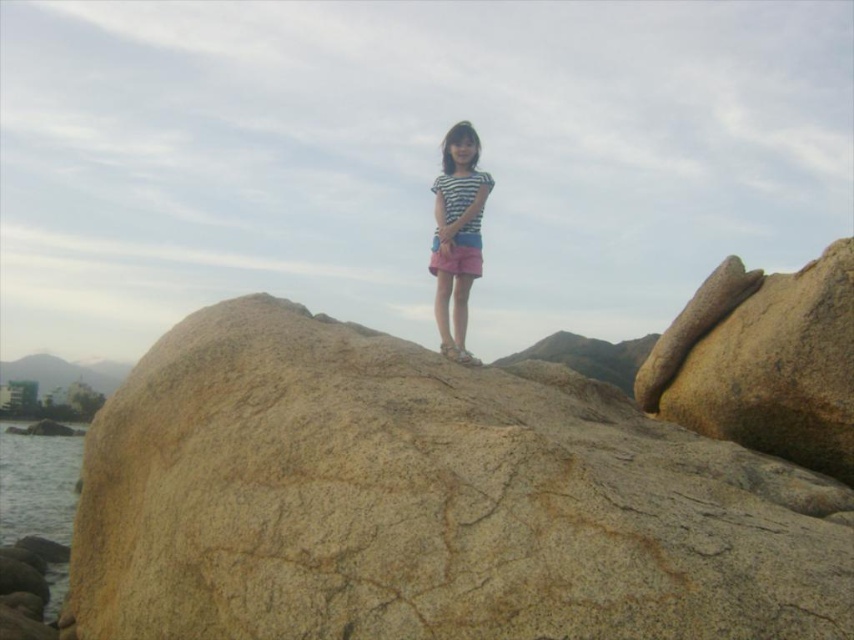
From the picture: Which of these two, granite rock at center or clear water at lower left, stands shorter?

With less height is granite rock at center.

Is granite rock at center behind clear water at lower left?

No, it is in front of clear water at lower left.

Does point (612, 413) come farther from viewer compared to point (69, 451)?

No, (612, 413) is in front of (69, 451).

Image resolution: width=854 pixels, height=640 pixels. I want to click on granite rock at center, so click(x=428, y=500).

Describe the element at coordinates (457, 234) in the screenshot. The width and height of the screenshot is (854, 640). I see `striped fabric shorts at center` at that location.

Does striped fabric shorts at center have a larger size compared to clear water at lower left?

Incorrect, striped fabric shorts at center is not larger than clear water at lower left.

Is point (451, 154) less distant than point (16, 422)?

Yes, point (451, 154) is closer to viewer.

Where is `striped fabric shorts at center`? The width and height of the screenshot is (854, 640). striped fabric shorts at center is located at coordinates (457, 234).

Measure the distance from granite rock at center to striped fabric shorts at center.

granite rock at center and striped fabric shorts at center are 9.67 feet apart.

In the scene shown: Is granite rock at center wider than striped fabric shorts at center?

Yes, granite rock at center is wider than striped fabric shorts at center.

Is point (82, 618) closer to viewer compared to point (454, 317)?

Yes, it is.

I want to click on granite rock at center, so click(x=428, y=500).